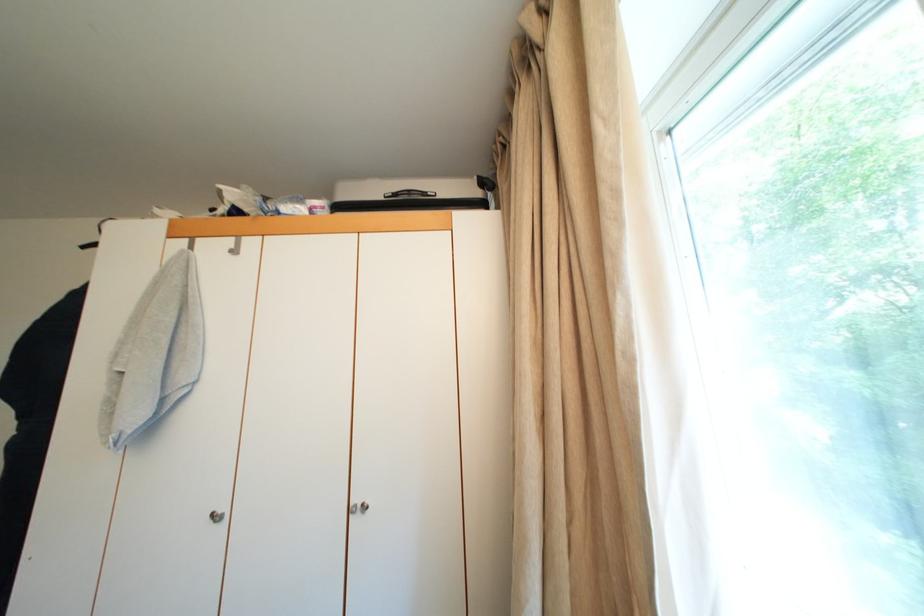
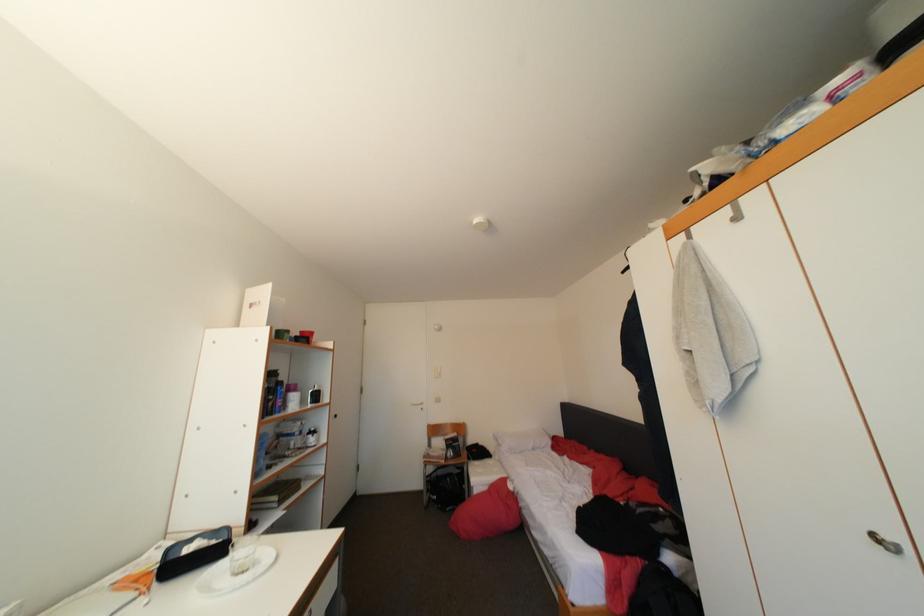
Question: The images are taken continuously from a first-person perspective. In which direction is your viewpoint rotating?

Choices:
 (A) Left
 (B) Right
 (C) Up
 (D) Down

Answer: (A)